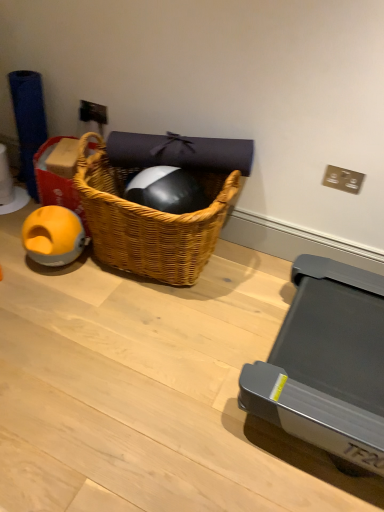
Identify the location of free space in front of woven wood picnic basket at center. (135, 338).